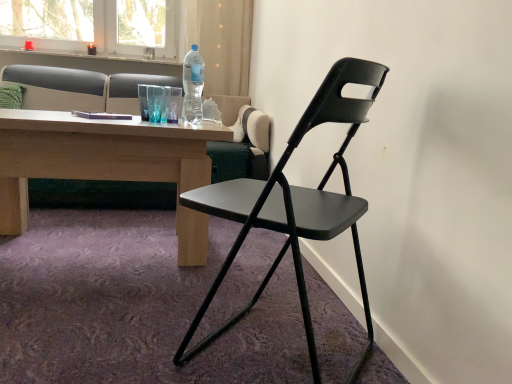
Question: In terms of width, does matte black folding chair at center look wider or thinner when compared to transparent plastic bottle at upper center?

Choices:
 (A) wide
 (B) thin

Answer: (A)

Question: Visually, is matte black folding chair at center positioned to the left or to the right of transparent plastic bottle at upper center?

Choices:
 (A) right
 (B) left

Answer: (A)

Question: Which of these objects is positioned closest to the matte gray studio couch at upper left?

Choices:
 (A) matte black folding chair at center
 (B) transparent plastic bottle at upper center
 (C) green fabric pillow at upper left

Answer: (C)

Question: Which object is positioned farthest from the green fabric pillow at upper left?

Choices:
 (A) matte black folding chair at center
 (B) matte gray studio couch at upper left
 (C) transparent plastic bottle at upper center

Answer: (A)